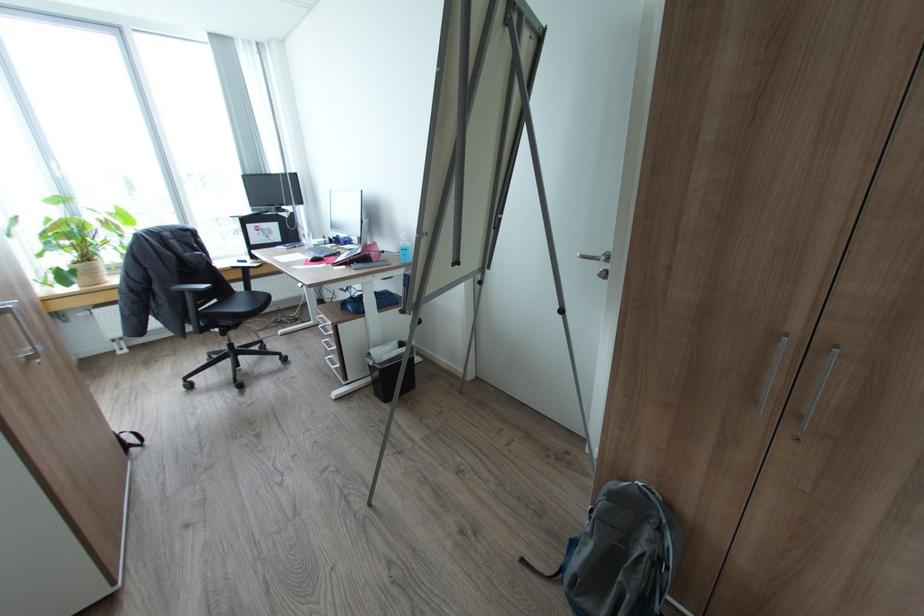
Find the location of `black chair armrest`. black chair armrest is located at coordinates click(189, 290).